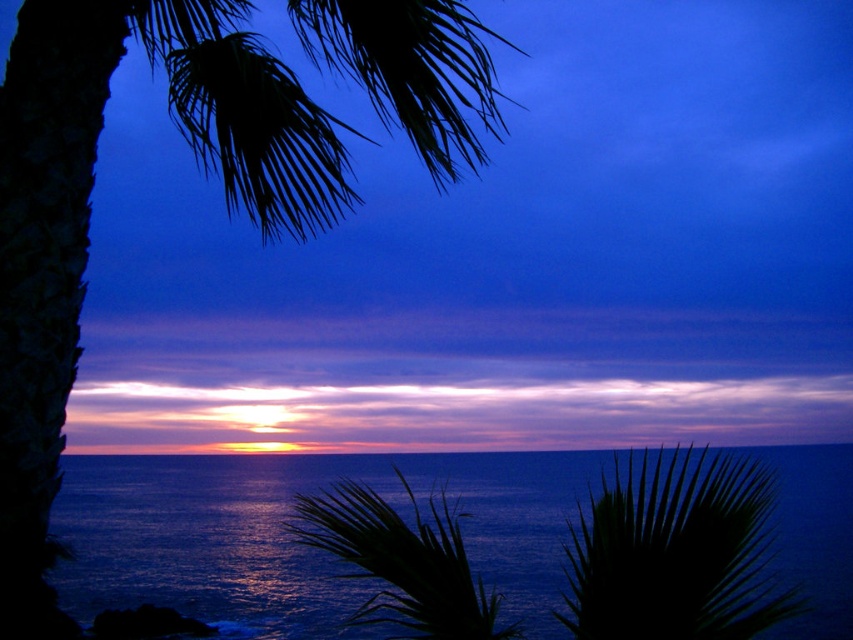
Question: Which object appears farthest from the camera in this image?

Choices:
 (A) blue liquid water at center
 (B) green leafy palm at center

Answer: (B)

Question: Which point is closer to the camera?

Choices:
 (A) (376, 518)
 (B) (431, 173)
 (C) (525, 477)

Answer: (B)

Question: Is blue liquid water at center to the left of green leafy palm at lower right from the viewer's perspective?

Choices:
 (A) no
 (B) yes

Answer: (B)

Question: Can you confirm if silky green fronds at upper left is positioned to the right of green leafy palm at center?

Choices:
 (A) yes
 (B) no

Answer: (B)

Question: Is the position of blue liquid water at center more distant than that of green leafy palm at lower right?

Choices:
 (A) yes
 (B) no

Answer: (B)

Question: Estimate the real-world distances between objects in this image. Which object is closer to the green leafy palm at center?

Choices:
 (A) silky green fronds at upper left
 (B) blue liquid water at center
 (C) green leafy palm at lower right

Answer: (B)